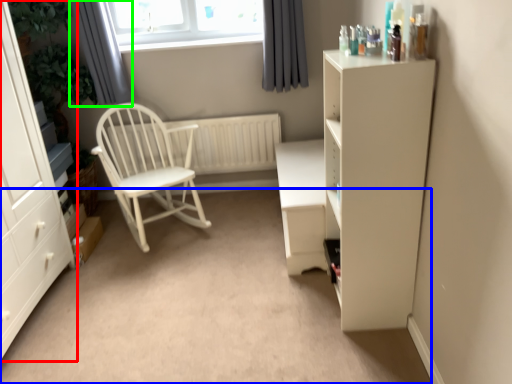
Question: Which is farther away from cabinetry (highlighted by a red box)? plain (highlighted by a blue box) or curtain (highlighted by a green box)?

Choices:
 (A) plain
 (B) curtain

Answer: (B)